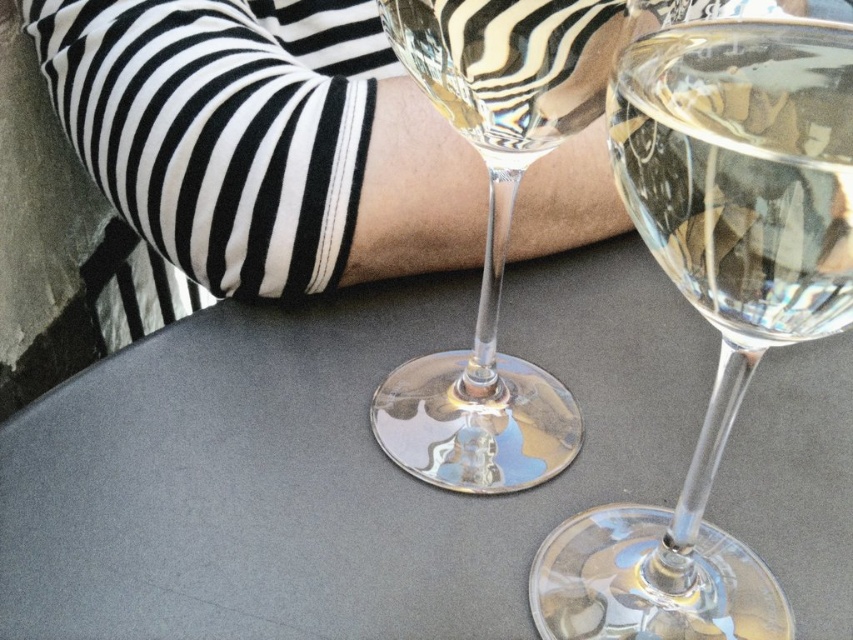
Question: Which of the following is the closest to the observer?

Choices:
 (A) clear glass wine at center
 (B) transparent glass wine glass at center
 (C) smooth gray table at center

Answer: (A)

Question: Which of the following is the closest to the observer?

Choices:
 (A) clear glass wine glass at center
 (B) smooth gray table at center
 (C) clear glass wine at center

Answer: (C)

Question: Does smooth gray table at center have a larger size compared to clear glass wine at center?

Choices:
 (A) no
 (B) yes

Answer: (B)

Question: Can you confirm if smooth gray table at center is positioned to the left of transparent glass wine glass at center?

Choices:
 (A) yes
 (B) no

Answer: (A)

Question: Is striped fabric arm at upper center below transparent glass wine glass at center?

Choices:
 (A) yes
 (B) no

Answer: (B)

Question: Among these points, which one is nearest to the camera?

Choices:
 (A) (604, 556)
 (B) (294, 196)
 (C) (840, 276)
 (D) (473, 321)

Answer: (C)